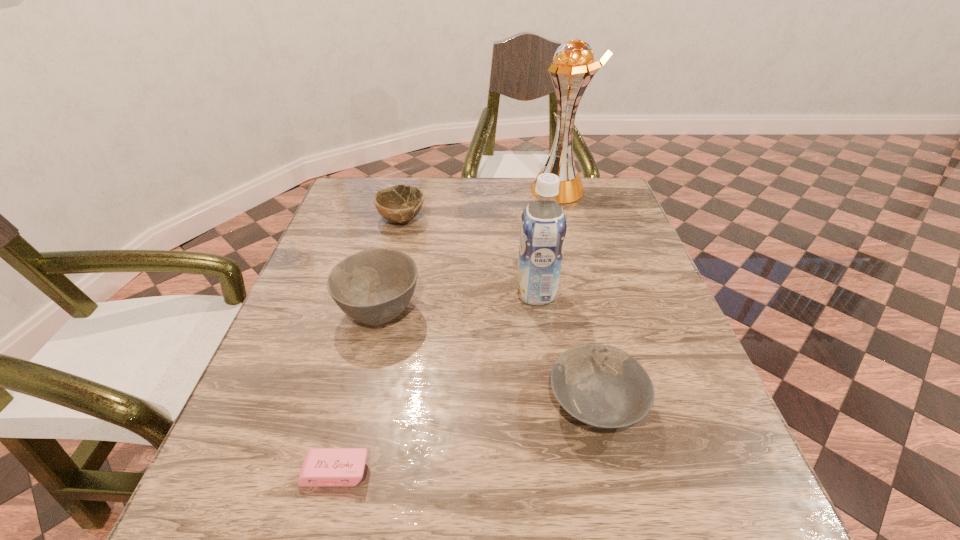
At what (x,y) coordinates should I click in order to perform the action: click on vacant space located 0.130m on the front-facing side of the farthest object. Please return your answer as a coordinate pair (x, y). Looking at the image, I should click on (488, 190).

In order to click on free region located on the front-facing side of the farthest object in this screenshot , I will do pyautogui.click(x=508, y=190).

Image resolution: width=960 pixels, height=540 pixels. Find the location of `vacant space located on the front-facing side of the farthest object`. vacant space located on the front-facing side of the farthest object is located at coordinates (431, 190).

What are the coordinates of `vacant space located 0.260m on the label of the soya milk` in the screenshot? It's located at (400, 293).

Identify the location of free space located on the label of the soya milk. (378, 293).

Image resolution: width=960 pixels, height=540 pixels. In order to click on vacant region located on the label of the soya milk in this screenshot , I will do `click(360, 293)`.

Where is `vacant space situated 0.130m on the back of the tallest bowl`? vacant space situated 0.130m on the back of the tallest bowl is located at coordinates (395, 249).

Where is `vacant space located 0.160m on the right of the farthest bowl`? This screenshot has width=960, height=540. vacant space located 0.160m on the right of the farthest bowl is located at coordinates (484, 219).

This screenshot has height=540, width=960. Find the location of `free point located on the front of the rightmost bowl`. free point located on the front of the rightmost bowl is located at coordinates (612, 480).

Where is `free spot located on the right of the nearest object`? This screenshot has width=960, height=540. free spot located on the right of the nearest object is located at coordinates (440, 472).